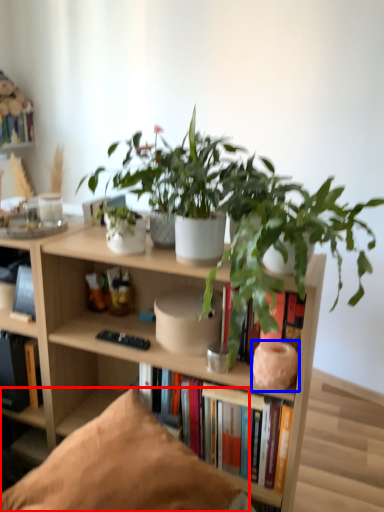
Question: Which point is closer to the camera, pillow (highlighted by a red box) or vase (highlighted by a blue box)?

Choices:
 (A) pillow
 (B) vase

Answer: (A)